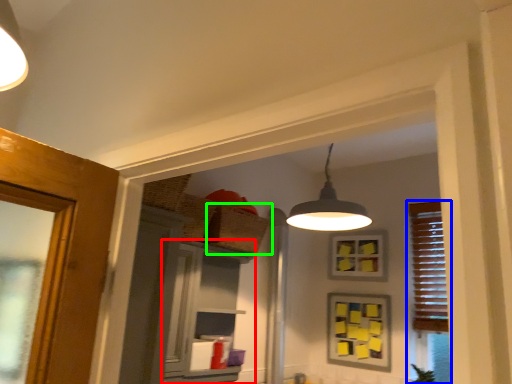
Question: Which is farther away from cabinetry (highlighted by a red box)? window (highlighted by a blue box) or basket (highlighted by a green box)?

Choices:
 (A) window
 (B) basket

Answer: (A)